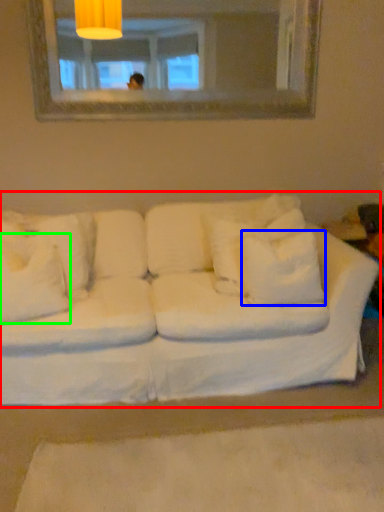
Question: Which is farther away from studio couch (highlighted by a red box)? pillow (highlighted by a blue box) or pillow (highlighted by a green box)?

Choices:
 (A) pillow
 (B) pillow

Answer: (B)